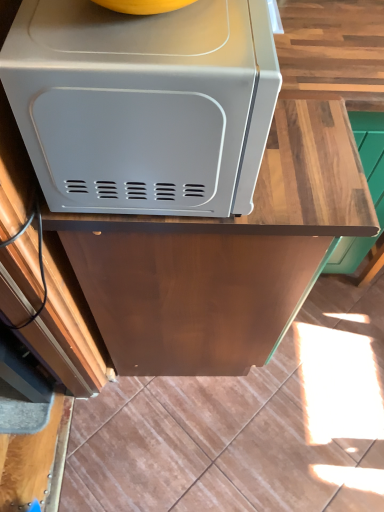
The width and height of the screenshot is (384, 512). I want to click on free spot to the right of satin white microwave at upper left, so [x=318, y=109].